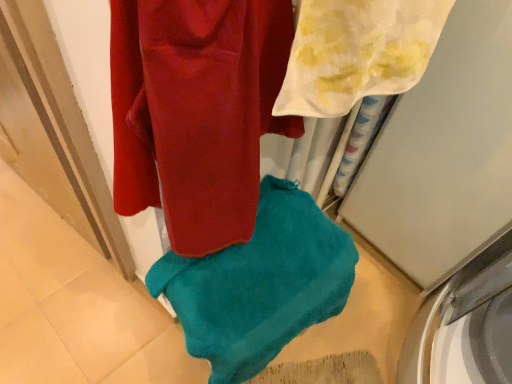
This screenshot has height=384, width=512. What do you see at coordinates (260, 284) in the screenshot?
I see `teal soft towel at center, placed as the second towel when sorted from top to bottom` at bounding box center [260, 284].

You are a GUI agent. You are given a task and a screenshot of the screen. Output one action in this format:
    pyautogui.click(x=<x>, y=<y>)
    Task: Click on the teal soft towel at center, which appears as the second towel when viewed from the front
    This screenshot has height=384, width=512.
    Given the screenshot: What is the action you would take?
    pyautogui.click(x=260, y=284)

Locate an element on the screen. Image resolution: width=512 pixels, height=384 pixels. washing machine on the right of teal soft towel at center, which appears as the 1th towel when viewed from the back is located at coordinates (465, 324).

Does teal soft towel at center, which ranks as the 1th towel in bottom-to-top order, turn towards white glossy washing machine at lower right?

No, teal soft towel at center, which ranks as the 1th towel in bottom-to-top order, is not facing towards white glossy washing machine at lower right.

Measure the distance between teal soft towel at center, which appears as the 1th towel when viewed from the back, and white glossy washing machine at lower right.

teal soft towel at center, which appears as the 1th towel when viewed from the back, and white glossy washing machine at lower right are 22.19 inches apart.

Considering the sizes of objects teal soft towel at center, which appears as the 1th towel when viewed from the back, and white glossy washing machine at lower right in the image provided, who is thinner, teal soft towel at center, which appears as the 1th towel when viewed from the back, or white glossy washing machine at lower right?

With smaller width is teal soft towel at center, which appears as the 1th towel when viewed from the back.

Could you tell me if white glossy washing machine at lower right is turned towards white sheer towel at upper right, marked as the 2th towel in a back-to-front arrangement?

No, white glossy washing machine at lower right is not turned towards white sheer towel at upper right, marked as the 2th towel in a back-to-front arrangement.

Can you confirm if white glossy washing machine at lower right is positioned to the left of white sheer towel at upper right, positioned as the 2th towel in bottom-to-top order?

No.

From a real-world perspective, is white glossy washing machine at lower right physically located above or below white sheer towel at upper right, positioned as the 1th towel in top-to-bottom order?

Clearly, from a real-world perspective, white glossy washing machine at lower right is below white sheer towel at upper right, positioned as the 1th towel in top-to-bottom order.

Does white glossy washing machine at lower right contain teal soft towel at center, which appears as the 1th towel when viewed from the back?

No, teal soft towel at center, which appears as the 1th towel when viewed from the back, is not a part of white glossy washing machine at lower right.

Who is shorter, white glossy washing machine at lower right or teal soft towel at center, which appears as the second towel when viewed from the front?

white glossy washing machine at lower right is shorter.

Based on the photo, is white glossy washing machine at lower right behind teal soft towel at center, which appears as the 1th towel when viewed from the back?

Yes.

Is white sheer towel at upper right, marked as the 2th towel in a back-to-front arrangement, facing towards teal soft towel at center, which appears as the 1th towel when viewed from the back?

No, white sheer towel at upper right, marked as the 2th towel in a back-to-front arrangement, is not turned towards teal soft towel at center, which appears as the 1th towel when viewed from the back.

Is point (304, 107) farther from camera compared to point (317, 301)?

No, it is in front of (317, 301).

Which is correct: white sheer towel at upper right, marked as the 2th towel in a back-to-front arrangement, is inside teal soft towel at center, which appears as the second towel when viewed from the front, or outside of it?

white sheer towel at upper right, marked as the 2th towel in a back-to-front arrangement, cannot be found inside teal soft towel at center, which appears as the second towel when viewed from the front.

Measure the distance from white sheer towel at upper right, marked as the 2th towel in a back-to-front arrangement, to teal soft towel at center, which appears as the second towel when viewed from the front.

white sheer towel at upper right, marked as the 2th towel in a back-to-front arrangement, and teal soft towel at center, which appears as the second towel when viewed from the front, are 45.00 centimeters apart.

Is teal soft towel at center, which ranks as the 1th towel in bottom-to-top order, inside or outside of white sheer towel at upper right, placed as the first towel when sorted from front to back?

teal soft towel at center, which ranks as the 1th towel in bottom-to-top order, is not enclosed by white sheer towel at upper right, placed as the first towel when sorted from front to back.

Could you measure the distance between teal soft towel at center, which appears as the second towel when viewed from the front, and white sheer towel at upper right, placed as the first towel when sorted from front to back?

The distance of teal soft towel at center, which appears as the second towel when viewed from the front, from white sheer towel at upper right, placed as the first towel when sorted from front to back, is 17.71 inches.

Would you say teal soft towel at center, placed as the second towel when sorted from top to bottom, is to the left or to the right of white sheer towel at upper right, marked as the 2th towel in a back-to-front arrangement, in the picture?

In the image, teal soft towel at center, placed as the second towel when sorted from top to bottom, appears on the left side of white sheer towel at upper right, marked as the 2th towel in a back-to-front arrangement.

Considering the sizes of objects white sheer towel at upper right, placed as the first towel when sorted from front to back, and white glossy washing machine at lower right in the image provided, who is shorter, white sheer towel at upper right, placed as the first towel when sorted from front to back, or white glossy washing machine at lower right?

With less height is white glossy washing machine at lower right.

From a real-world perspective, is white sheer towel at upper right, marked as the 2th towel in a back-to-front arrangement, physically located above or below white glossy washing machine at lower right?

From a real-world perspective, white sheer towel at upper right, marked as the 2th towel in a back-to-front arrangement, is physically above white glossy washing machine at lower right.

From the image's perspective, is white sheer towel at upper right, positioned as the 1th towel in top-to-bottom order, over white glossy washing machine at lower right?

Yes, from the image's perspective, white sheer towel at upper right, positioned as the 1th towel in top-to-bottom order, is above white glossy washing machine at lower right.

Is point (307, 72) closer to camera compared to point (490, 367)?

Yes, it is in front of point (490, 367).

Where is `washing machine below the teal soft towel at center, which appears as the second towel when viewed from the front (from a real-world perspective)`? washing machine below the teal soft towel at center, which appears as the second towel when viewed from the front (from a real-world perspective) is located at coordinates (465, 324).

You are a GUI agent. You are given a task and a screenshot of the screen. Output one action in this format:
    pyautogui.click(x=<x>, y=<y>)
    Task: Click on the towel that is the 2nd one above the white glossy washing machine at lower right (from a real-world perspective)
    The height and width of the screenshot is (384, 512).
    Given the screenshot: What is the action you would take?
    pyautogui.click(x=357, y=52)

Which object lies further to the anchor point white sheer towel at upper right, positioned as the 1th towel in top-to-bottom order, white glossy washing machine at lower right or teal soft towel at center, which appears as the second towel when viewed from the front?

The object further to white sheer towel at upper right, positioned as the 1th towel in top-to-bottom order, is white glossy washing machine at lower right.

Looking at the image, which one is located closer to teal soft towel at center, which appears as the second towel when viewed from the front, white glossy washing machine at lower right or white sheer towel at upper right, placed as the first towel when sorted from front to back?

Among the two, white sheer towel at upper right, placed as the first towel when sorted from front to back, is located nearer to teal soft towel at center, which appears as the second towel when viewed from the front.

Estimate the real-world distances between objects in this image. Which object is further from white sheer towel at upper right, positioned as the 2th towel in bottom-to-top order, teal soft towel at center, which ranks as the 1th towel in bottom-to-top order, or white glossy washing machine at lower right?

white glossy washing machine at lower right.

Looking at the image, which one is located further to white glossy washing machine at lower right, white sheer towel at upper right, marked as the 2th towel in a back-to-front arrangement, or teal soft towel at center, placed as the second towel when sorted from top to bottom?

white sheer towel at upper right, marked as the 2th towel in a back-to-front arrangement.

From the image, which object appears to be farther from teal soft towel at center, which appears as the 1th towel when viewed from the back, white sheer towel at upper right, positioned as the 1th towel in top-to-bottom order, or white glossy washing machine at lower right?

white glossy washing machine at lower right is further to teal soft towel at center, which appears as the 1th towel when viewed from the back.

When comparing their distances from white glossy washing machine at lower right, does teal soft towel at center, which ranks as the 1th towel in bottom-to-top order, or white sheer towel at upper right, placed as the first towel when sorted from front to back, seem closer?

teal soft towel at center, which ranks as the 1th towel in bottom-to-top order, is closer to white glossy washing machine at lower right.

This screenshot has height=384, width=512. In order to click on towel that lies between white sheer towel at upper right, positioned as the 2th towel in bottom-to-top order, and white glossy washing machine at lower right from top to bottom in this screenshot , I will do `click(260, 284)`.